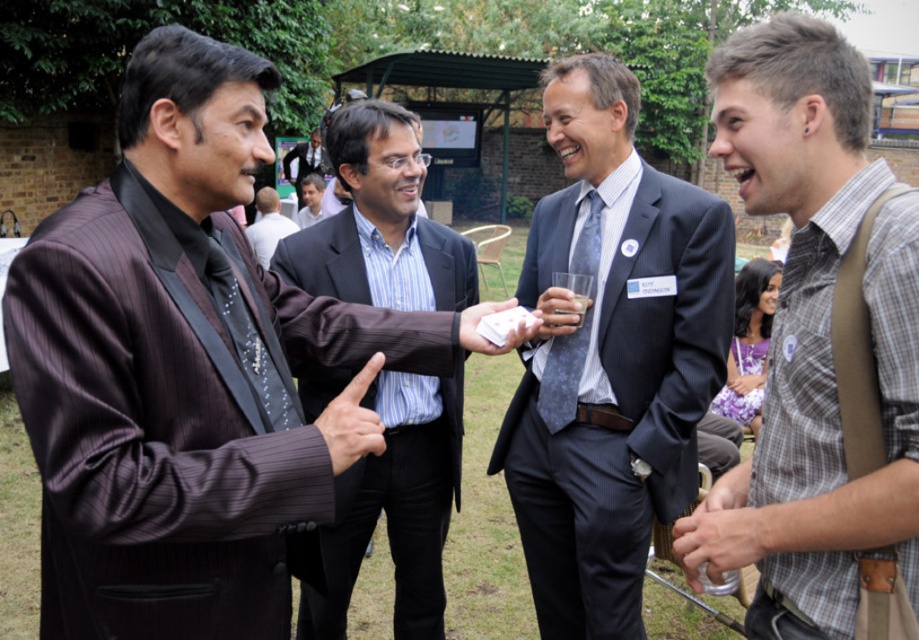
You are a photographer at the event and want to capture a photo of the blue textured tie at center and the striped suit at center. Which object is shorter in height?

The blue textured tie at center is not as tall as the striped suit at center, so the blue textured tie at center is shorter in height.

Based on the scene description, which object is positioned higher between the shiny black suit at center and the dark blue suit at center?

The shiny black suit at center is positioned higher than the dark blue suit at center according to the description.

You are organizing a charity event and need to ensure all participants have matching attire. You have a dark blue suit at center and a blue textured tie at center. Which item should you adjust to ensure proper proportions?

The dark blue suit at center has a larger size compared to the blue textured tie at center, so you should adjust the blue textured tie at center to be larger to match the size of the dark blue suit at center for proper proportions.